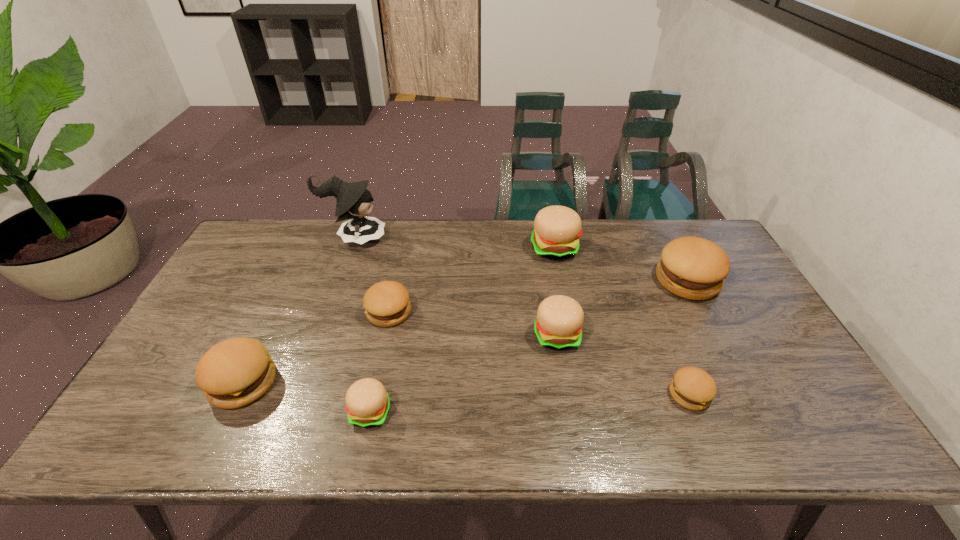
Locate an element on the screen. The height and width of the screenshot is (540, 960). empty space between the doll and the biggest beige hamburger is located at coordinates (454, 244).

You are a GUI agent. You are given a task and a screenshot of the screen. Output one action in this format:
    pyautogui.click(x=<x>, y=<y>)
    Task: Click on the blank region between the third brown hamburger from right to left and the biggest brown hamburger
    
    Given the screenshot: What is the action you would take?
    pyautogui.click(x=538, y=296)

The width and height of the screenshot is (960, 540). Identify the location of vacant space in between the biggest brown hamburger and the biggest beige hamburger. (621, 265).

The image size is (960, 540). Identify the location of blank region between the biggest beige hamburger and the third brown hamburger from right to left. (471, 280).

Find the location of a particular element. This screenshot has height=540, width=960. vacant area between the smallest beige hamburger and the leftmost hamburger is located at coordinates (306, 397).

Where is `free spot between the second farthest beige hamburger and the biggest brown hamburger`? This screenshot has width=960, height=540. free spot between the second farthest beige hamburger and the biggest brown hamburger is located at coordinates click(622, 308).

Where is `the fourth closest object to the second nearest beige hamburger`? the fourth closest object to the second nearest beige hamburger is located at coordinates (386, 303).

Choose which object is the second nearest neighbor to the second biggest brown hamburger. Please provide its 2D coordinates. Your answer should be formatted as a tuple, i.e. [(x, y)], where the tuple contains the x and y coordinates of a point satisfying the conditions above.

[(386, 303)]

Image resolution: width=960 pixels, height=540 pixels. I want to click on the third closest hamburger to the second brown hamburger from left to right, so click(558, 325).

Where is `hamburger that stands as the fourth closest to the third brown hamburger from right to left`? hamburger that stands as the fourth closest to the third brown hamburger from right to left is located at coordinates (557, 229).